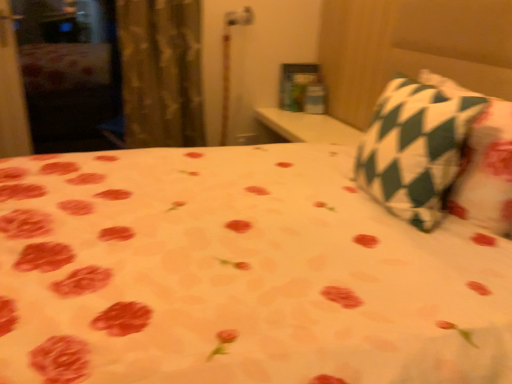
In order to face green checkered pillow at upper right, should I rotate leftwards or rightwards?

It's best to rotate right around 23.173 degrees.

What is the approximate height of green checkered pillow at upper right?

green checkered pillow at upper right is 15.59 inches in height.

You are a GUI agent. You are given a task and a screenshot of the screen. Output one action in this format:
    pyautogui.click(x=<x>, y=<y>)
    Task: Click on the green checkered pillow at upper right
    This screenshot has width=512, height=384.
    Given the screenshot: What is the action you would take?
    pyautogui.click(x=439, y=154)

Image resolution: width=512 pixels, height=384 pixels. Describe the element at coordinates (439, 154) in the screenshot. I see `green checkered pillow at upper right` at that location.

What are the coordinates of `textured beige curtain at left` in the screenshot? It's located at (161, 72).

This screenshot has width=512, height=384. Describe the element at coordinates (161, 72) in the screenshot. I see `textured beige curtain at left` at that location.

Locate an element on the screen. This screenshot has height=384, width=512. green checkered pillow at upper right is located at coordinates (439, 154).

Is textured beige curtain at left to the left or to the right of green checkered pillow at upper right in the image?

From the image, it's evident that textured beige curtain at left is to the left of green checkered pillow at upper right.

Which is behind, textured beige curtain at left or green checkered pillow at upper right?

textured beige curtain at left is more distant.

Considering the positions of point (185, 73) and point (400, 143), is point (185, 73) closer or farther from the camera than point (400, 143)?

Point (185, 73) is positioned farther from the camera compared to point (400, 143).

From the image's perspective, relative to green checkered pillow at upper right, is textured beige curtain at left above or below?

textured beige curtain at left is situated higher than green checkered pillow at upper right in the image.

From a real-world perspective, between textured beige curtain at left and green checkered pillow at upper right, who is vertically lower?

From a 3D spatial view, textured beige curtain at left is below.

Looking at their sizes, would you say textured beige curtain at left is wider or thinner than green checkered pillow at upper right?

Clearly, textured beige curtain at left has more width compared to green checkered pillow at upper right.

Can you confirm if textured beige curtain at left is shorter than green checkered pillow at upper right?

Incorrect, the height of textured beige curtain at left does not fall short of that of green checkered pillow at upper right.

Does textured beige curtain at left have a smaller size compared to green checkered pillow at upper right?

No, textured beige curtain at left is not smaller than green checkered pillow at upper right.

Looking at this image, is green checkered pillow at upper right completely or partially inside textured beige curtain at left?

Definitely not — green checkered pillow at upper right is not inside textured beige curtain at left.

Is textured beige curtain at left beside green checkered pillow at upper right?

No, textured beige curtain at left is not next to green checkered pillow at upper right.

From the picture: Is textured beige curtain at left facing away from green checkered pillow at upper right?

No.

What's the angular difference between textured beige curtain at left and green checkered pillow at upper right's facing directions?

90.9 degrees.

Find the location of a particular element. The height and width of the screenshot is (384, 512). curtain beneath the green checkered pillow at upper right (from a real-world perspective) is located at coordinates (161, 72).

Between green checkered pillow at upper right and textured beige curtain at left, which one appears on the left side from the viewer's perspective?

textured beige curtain at left is more to the left.

In the image, is green checkered pillow at upper right positioned in front of or behind textured beige curtain at left?

Clearly, green checkered pillow at upper right is in front of textured beige curtain at left.

Is point (451, 207) closer or farther from the camera than point (148, 46)?

Point (451, 207).

From the image's perspective, does green checkered pillow at upper right appear lower than textured beige curtain at left?

Yes.

From a real-world perspective, who is located higher, green checkered pillow at upper right or textured beige curtain at left?

green checkered pillow at upper right, from a real-world perspective.

Between green checkered pillow at upper right and textured beige curtain at left, which one has smaller width?

With smaller width is green checkered pillow at upper right.

Considering the sizes of objects green checkered pillow at upper right and textured beige curtain at left in the image provided, who is taller, green checkered pillow at upper right or textured beige curtain at left?

textured beige curtain at left is taller.

Considering the relative sizes of green checkered pillow at upper right and textured beige curtain at left in the image provided, is green checkered pillow at upper right bigger than textured beige curtain at left?

No.

Is green checkered pillow at upper right not inside textured beige curtain at left?

Yes.

Is green checkered pillow at upper right not near textured beige curtain at left?

Yes.

Is green checkered pillow at upper right oriented away from textured beige curtain at left?

green checkered pillow at upper right does not have its back to textured beige curtain at left.

How different are the orientations of green checkered pillow at upper right and textured beige curtain at left in degrees?

90.9 degrees separate the facing orientations of green checkered pillow at upper right and textured beige curtain at left.

Image resolution: width=512 pixels, height=384 pixels. In order to click on curtain above the green checkered pillow at upper right (from the image's perspective) in this screenshot , I will do `click(161, 72)`.

At what (x,y) coordinates should I click in order to perform the action: click on curtain that is under the green checkered pillow at upper right (from a real-world perspective). Please return your answer as a coordinate pair (x, y). The height and width of the screenshot is (384, 512). Looking at the image, I should click on (161, 72).

Identify the location of curtain that appears behind the green checkered pillow at upper right. (161, 72).